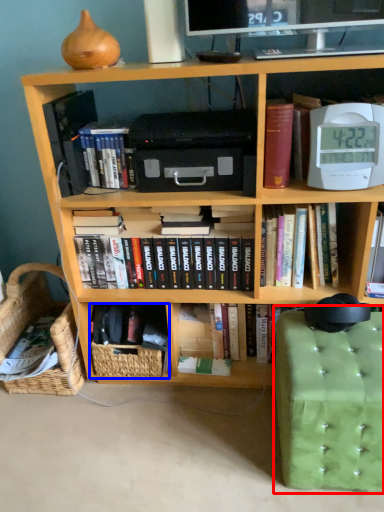
Question: Among these objects, which one is nearest to the camera, swivel chair (highlighted by a red box) or basket (highlighted by a blue box)?

Choices:
 (A) swivel chair
 (B) basket

Answer: (A)